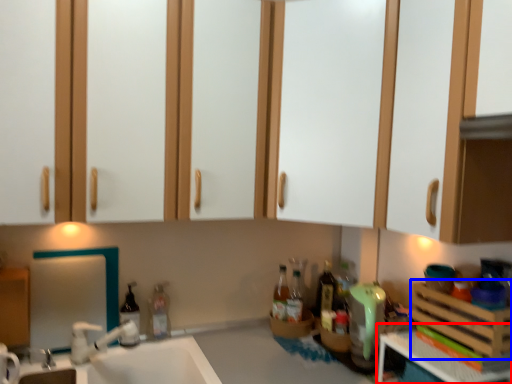
Question: Which object appears farthest to the camera in this image, counter top (highlighted by a red box) or basket (highlighted by a blue box)?

Choices:
 (A) counter top
 (B) basket

Answer: (B)